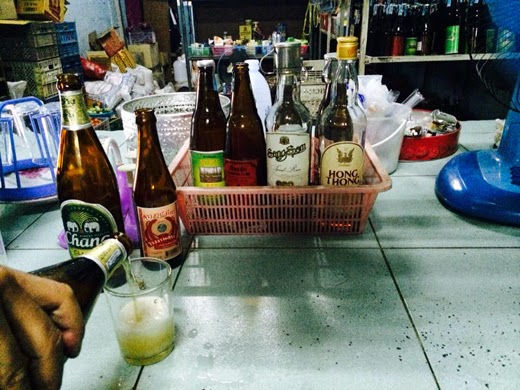
Identify the location of plastic basket. This screenshot has width=520, height=390. (303, 203).